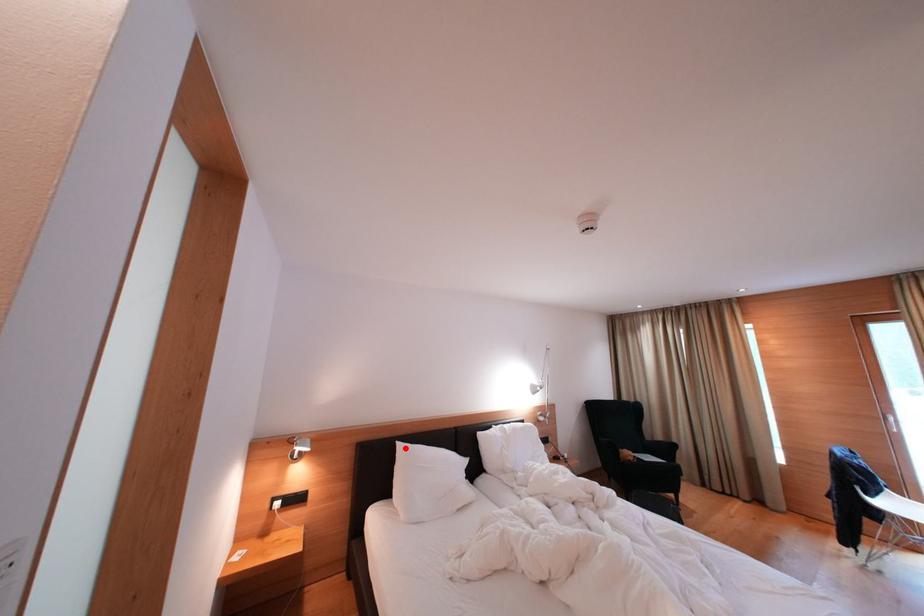
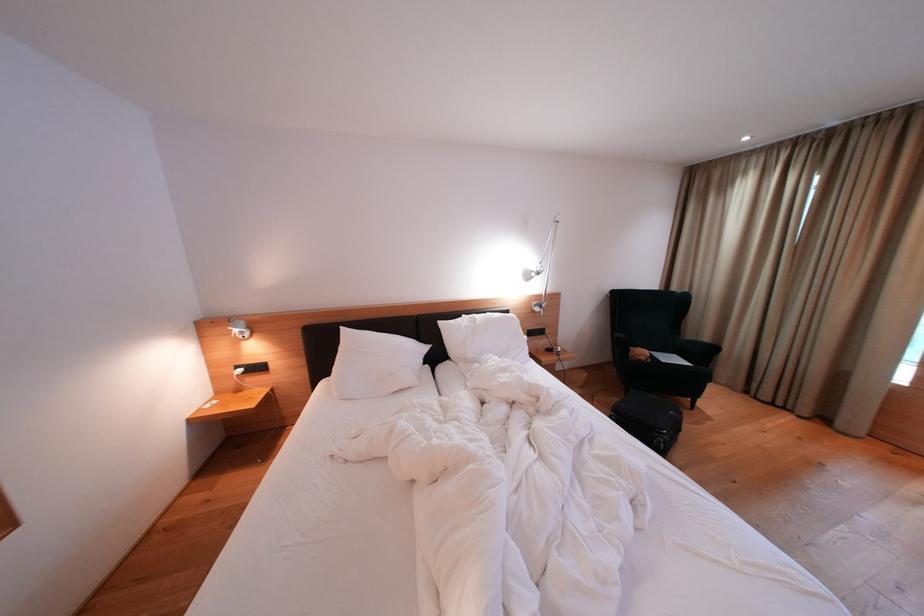
The point at the highlighted location is marked in the first image. Where is the corresponding point in the second image?

(349, 333)